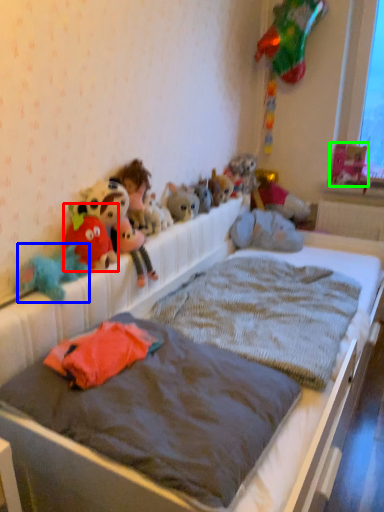
Question: Which object is the farthest from toy (highlighted by a red box)? Choose among these: toy (highlighted by a blue box) or toy (highlighted by a green box).

Choices:
 (A) toy
 (B) toy

Answer: (B)